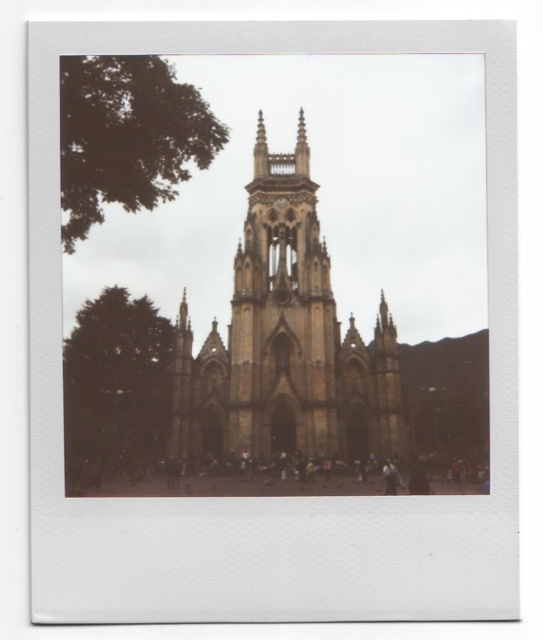
This screenshot has width=543, height=640. What do you see at coordinates (281, 314) in the screenshot? I see `light brown stone tower at center` at bounding box center [281, 314].

Is light brown stone tower at center smaller than green leafy tree at left?

No.

Which is in front, point (249, 253) or point (78, 470)?

Point (78, 470)

You are a GUI agent. You are given a task and a screenshot of the screen. Output one action in this format:
    pyautogui.click(x=<x>, y=<y>)
    Task: Click on the light brown stone tower at center
    Image resolution: width=543 pixels, height=640 pixels.
    Given the screenshot: What is the action you would take?
    pyautogui.click(x=281, y=314)

Does point (269, 241) come in front of point (116, 67)?

No, (269, 241) is further to viewer.

Looking at this image, between brown stone church at center and green leafy tree at upper left, which one appears on the left side from the viewer's perspective?

green leafy tree at upper left

Is point (397, 452) closer to camera compared to point (176, 113)?

Yes.

Where is `brown stone church at center`? The image size is (543, 640). brown stone church at center is located at coordinates (286, 340).

Who is taller, brown stone church at center or light brown stone tower at center?

brown stone church at center is taller.

Can you confirm if brown stone church at center is shorter than light brown stone tower at center?

Incorrect, brown stone church at center's height does not fall short of light brown stone tower at center's.

The image size is (543, 640). I want to click on brown stone church at center, so click(x=286, y=340).

In order to click on brown stone church at center in this screenshot , I will do `click(286, 340)`.